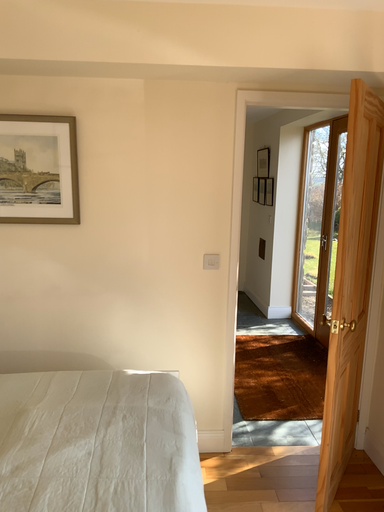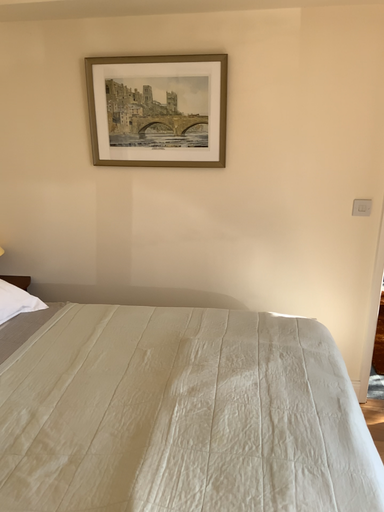
Question: Which way did the camera rotate in the video?

Choices:
 (A) rotated right
 (B) rotated left

Answer: (B)